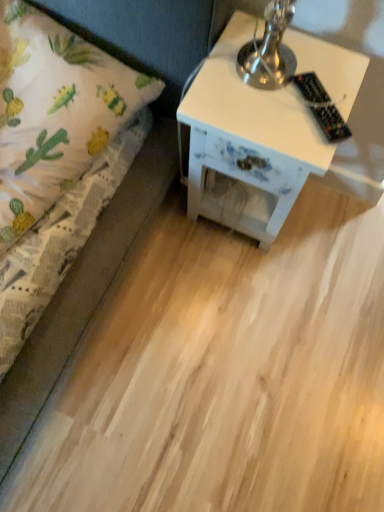
Where is `vacant space behind black plastic remote control at upper right`? vacant space behind black plastic remote control at upper right is located at coordinates (319, 55).